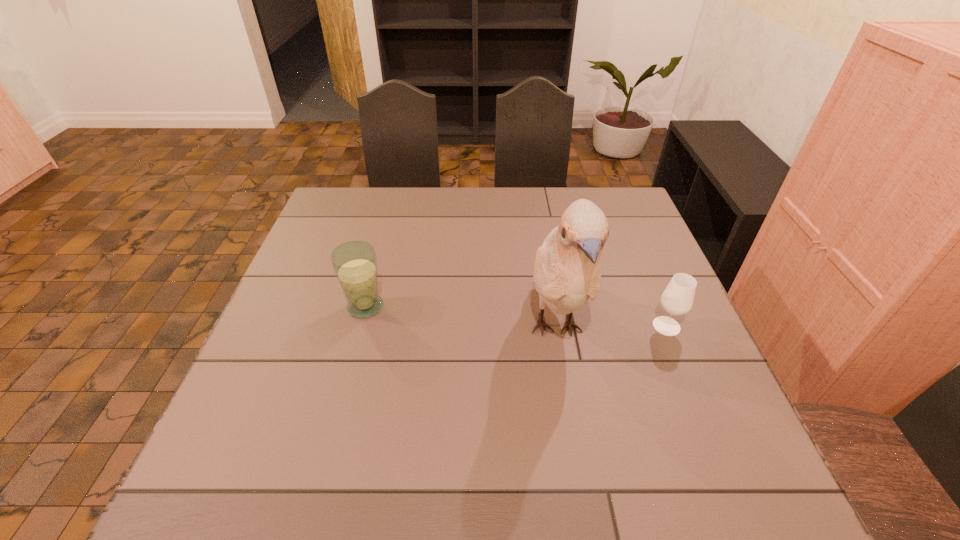
Image resolution: width=960 pixels, height=540 pixels. I want to click on free space between the second object from right to left and the left glass, so click(461, 318).

Where is `unoccupied position between the shortest object and the leftmost object`? unoccupied position between the shortest object and the leftmost object is located at coordinates (516, 316).

Image resolution: width=960 pixels, height=540 pixels. What are the coordinates of `empty space between the parakeet and the left glass` in the screenshot? It's located at (461, 318).

You are a GUI agent. You are given a task and a screenshot of the screen. Output one action in this format:
    pyautogui.click(x=<x>, y=<y>)
    Task: Click on the free spot between the shortest object and the left glass
    The height and width of the screenshot is (540, 960).
    Given the screenshot: What is the action you would take?
    pyautogui.click(x=516, y=316)

Find the location of a particular element. This screenshot has width=960, height=540. vacant area that lies between the rightmost object and the second object from left to right is located at coordinates (611, 327).

Locate an element on the screen. The width and height of the screenshot is (960, 540). free space between the right glass and the left glass is located at coordinates (x=516, y=316).

Choose which object is the nearest neighbor to the rightmost object. Please provide its 2D coordinates. Your answer should be formatted as a tuple, i.e. [(x, y)], where the tuple contains the x and y coordinates of a point satisfying the conditions above.

[(567, 272)]

Identify the location of object that stands as the closest to the second object from left to right. The width and height of the screenshot is (960, 540). (677, 299).